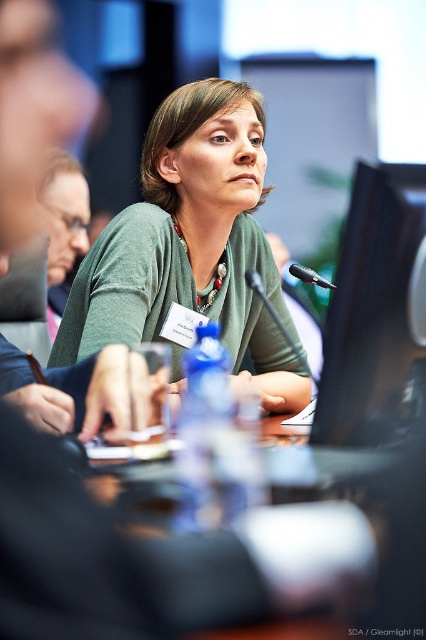
You are organizing a conference and need to ensure that the green matte cardigan at center and the transparent glass table at center are visible in the photo. Which object should be placed closer to the camera to ensure both are in focus?

The green matte cardigan at center is located above the transparent glass table at center. To ensure both are in focus, the transparent glass table at center should be placed closer to the camera because it is lower and the cardigan is above it, so adjusting the camera angle or distance to capture both layers would require prioritizing the lower object for depth of field.

You are organizing a conference and need to place a name tag holder on the table. The name tag holder requires a surface that is to the right of the black plastic microphone at center. Can you place it on the transparent glass table at center?

The transparent glass table at center is positioned on the left side of black plastic microphone at center, so it is not to the right. You cannot place the name tag holder there.

You are a photographer setting up for a conference photo. You need to ensure that the green matte cardigan at center is visible above the black glossy monitor at center in the final shot. Based on the scene description, can you confirm if this is possible?

Yes, the green matte cardigan at center is taller than the black glossy monitor at center, so it will naturally appear visible above it in the photo.